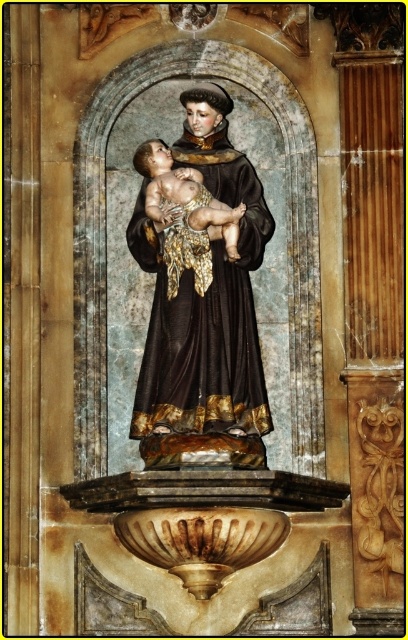
Based on the photo, you are an art conservator examining the statue in the niche. You notice a specific point marked at coordinates point [204,324]. What material is located at this point?

The point [204,324] marks shiny dark brown fabric at center.

You are an art conservator examining the statue in the niche. You need to determine which part of the statue requires more material for restoration. Based on the shiny dark brown fabric at center and the smooth gold cloth at center, which one would need more material?

The shiny dark brown fabric at center has a larger size compared to the smooth gold cloth at center, so it would require more material for restoration.

You are an art conservator examining the statue in the niche. You notice two fabrics on the central figure. The shiny dark brown fabric at center and the smooth gold cloth at center. Which fabric is positioned lower on the figure?

The shiny dark brown fabric at center is located below the smooth gold cloth at center, so it is positioned lower on the figure.